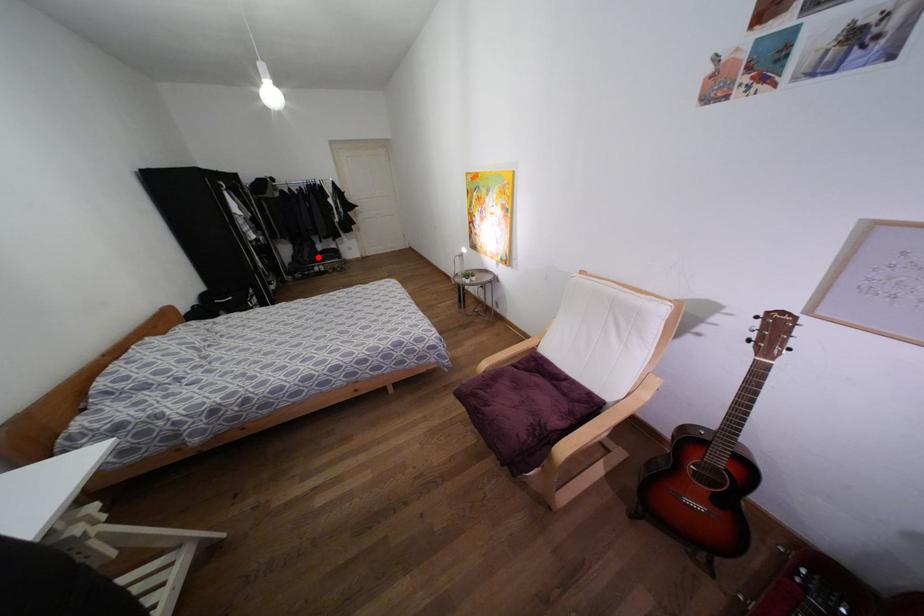
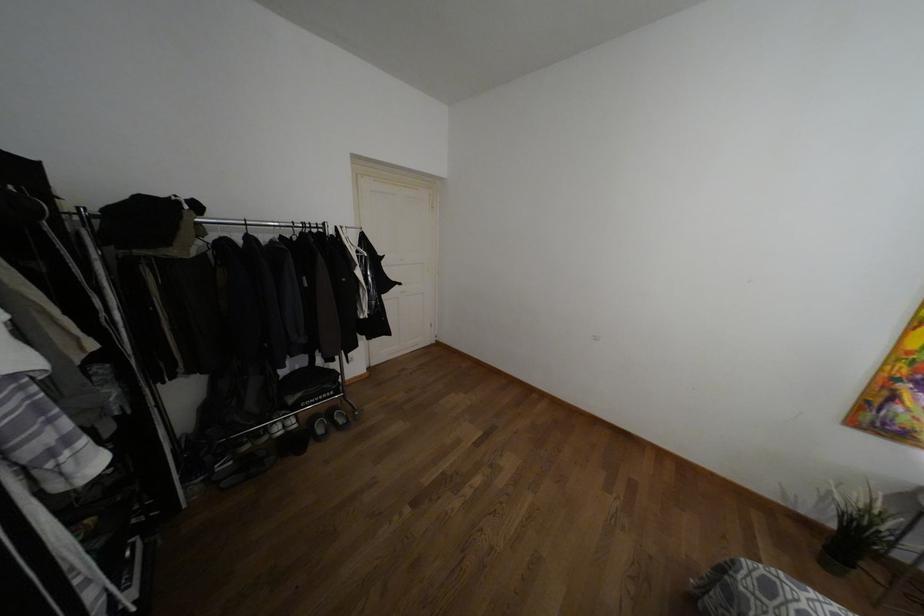
Where in the second image is the point corresponding to the highlighted location from the first image?

(290, 399)